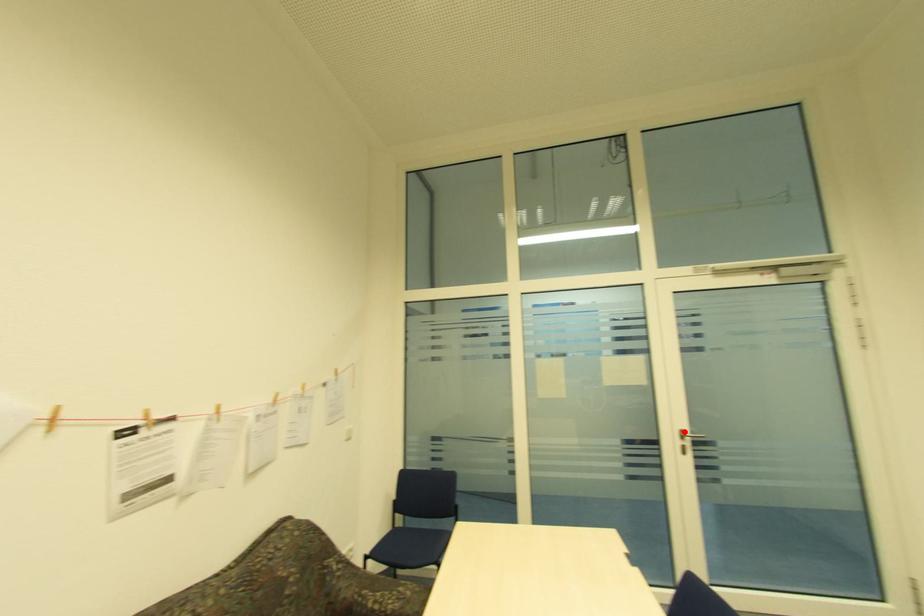
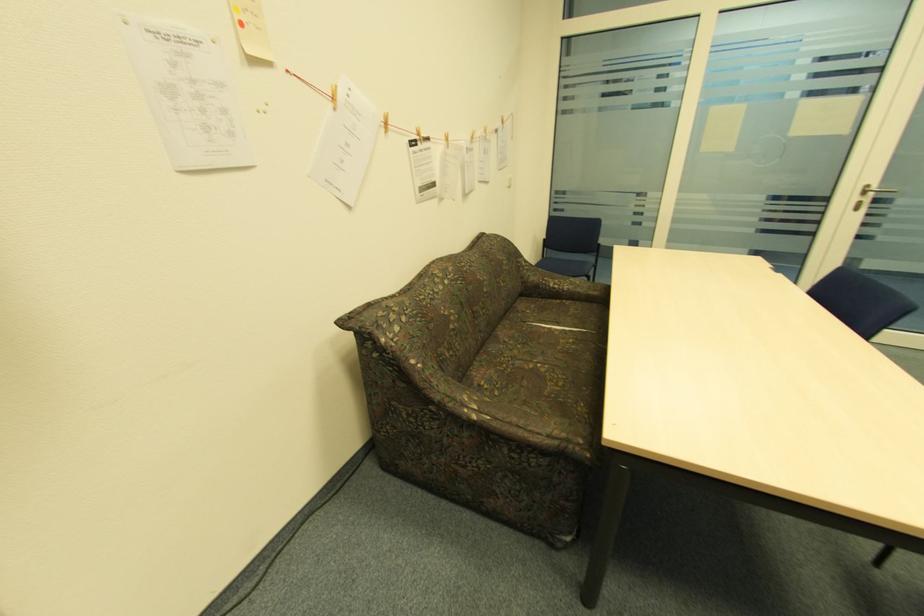
Question: I am providing you with two images of the same scene from different viewpoints. Image1 has a red point marked. In image2, the corresponding 3D location appears at what relative position? Reply with the corresponding letter.

Choices:
 (A) Closer
 (B) Farther

Answer: (B)